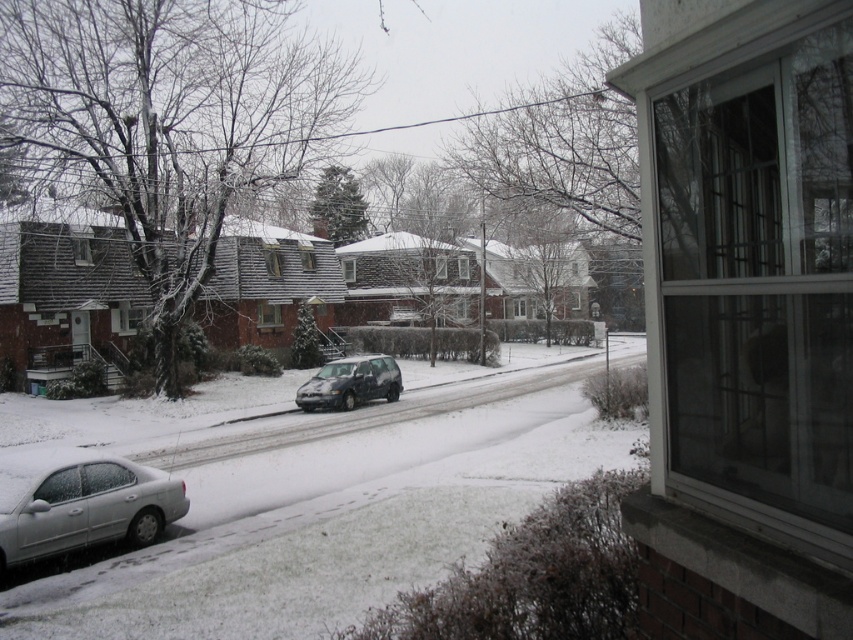
Who is lower down, white matte sedan at lower left or satin black suv at center?

Positioned lower is white matte sedan at lower left.

Does white matte sedan at lower left appear over satin black suv at center?

No, white matte sedan at lower left is not above satin black suv at center.

Where is `white matte sedan at lower left`? The height and width of the screenshot is (640, 853). white matte sedan at lower left is located at coordinates (80, 502).